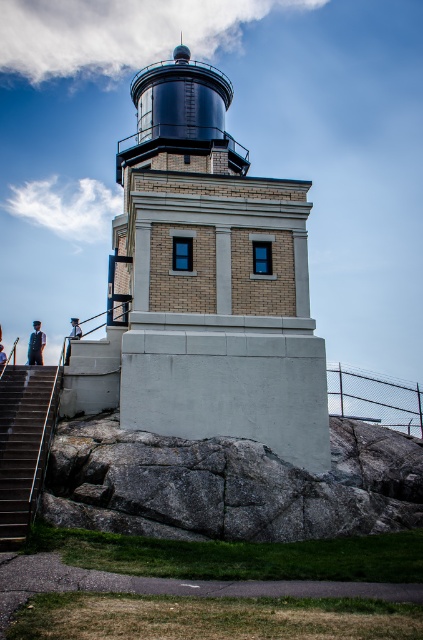
Question: Estimate the real-world distances between objects in this image. Which object is farther from the light brown wooden post at lower left?

Choices:
 (A) gray rock at lower center
 (B) brick textured tower at center
 (C) matte black graduation gown at lower left

Answer: (A)

Question: Estimate the real-world distances between objects in this image. Which object is closer to the light brown wooden post at lower left?

Choices:
 (A) brick textured tower at center
 (B) matte black person at upper left

Answer: (A)

Question: Observing the image, what is the correct spatial positioning of gray rock at lower center in reference to metallic gray stairs at lower left?

Choices:
 (A) above
 (B) below

Answer: (B)

Question: Which object is closer to the camera taking this photo?

Choices:
 (A) matte black person at upper left
 (B) brick textured tower at center

Answer: (B)

Question: Where is metallic gray stairs at lower left located in relation to light brown wooden post at lower left in the image?

Choices:
 (A) below
 (B) above

Answer: (A)

Question: Can you confirm if gray rock at lower center is positioned above matte black person at upper left?

Choices:
 (A) yes
 (B) no

Answer: (B)